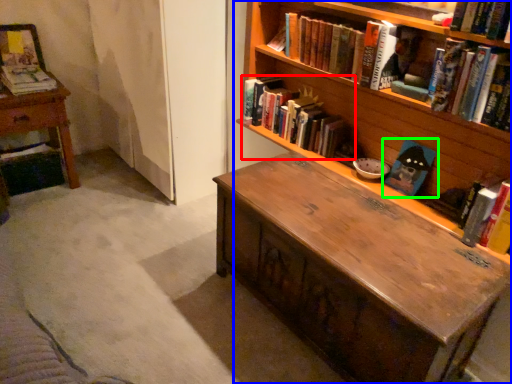
Question: Based on their relative distances, which object is farther from book (highlighted by a red box)? Choose from bookcase (highlighted by a blue box) and book (highlighted by a green box).

Choices:
 (A) bookcase
 (B) book

Answer: (B)